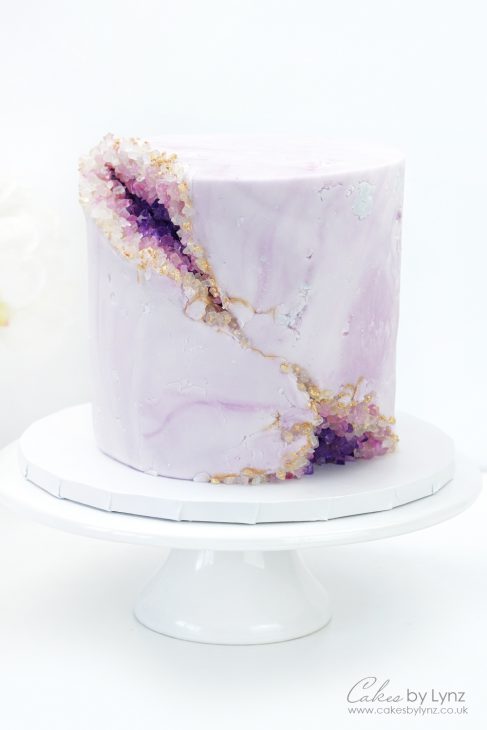
You are a GUI agent. You are given a task and a screenshot of the screen. Output one action in this format:
    pyautogui.click(x=<x>, y=<y>)
    Task: Click on the white cake stand
    The height and width of the screenshot is (730, 487).
    Given the screenshot: What is the action you would take?
    pyautogui.click(x=118, y=536)